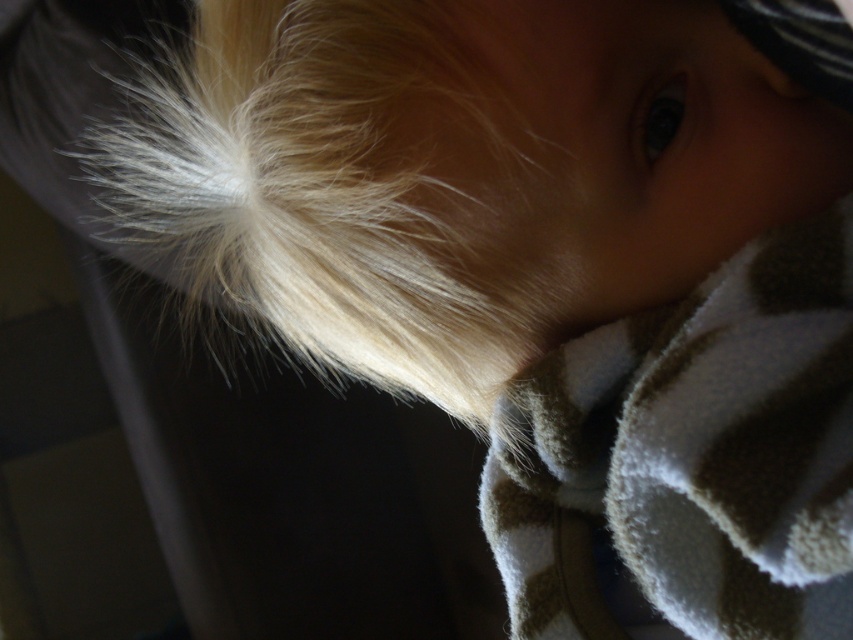
Between blonde silky hair at upper left and brown fleece blanket at lower right, which one is positioned lower?

brown fleece blanket at lower right

Measure the distance between point (412, 316) and camera.

Point (412, 316) and camera are 44.44 centimeters apart from each other.

You are a GUI agent. You are given a task and a screenshot of the screen. Output one action in this format:
    pyautogui.click(x=<x>, y=<y>)
    Task: Click on the blonde silky hair at upper left
    This screenshot has width=853, height=640.
    Given the screenshot: What is the action you would take?
    355,188